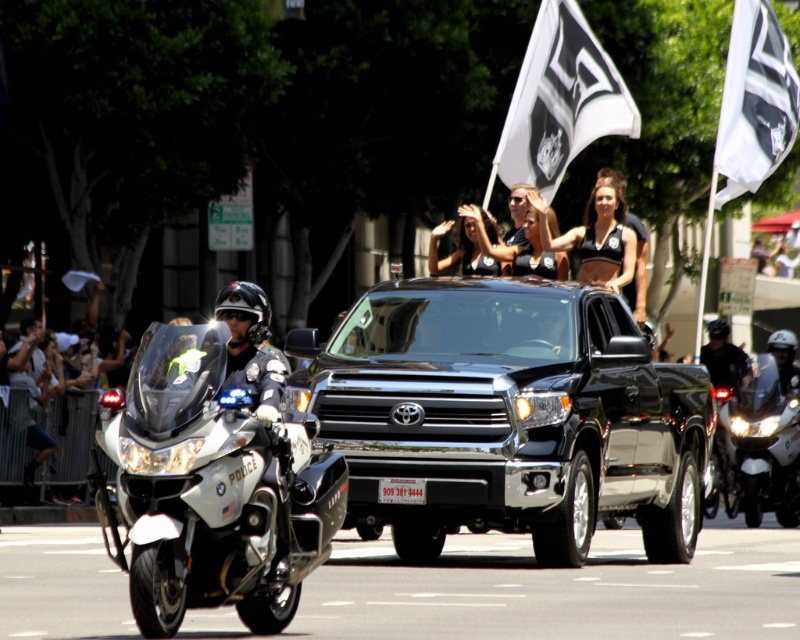
Which is in front, point (512, 132) or point (742, 422)?

Point (742, 422) is more forward.

Does point (594, 131) come behind point (742, 500)?

Yes, point (594, 131) is behind point (742, 500).

Between point (616, 77) and point (772, 362), which one is positioned behind?

The point (616, 77) is behind.

The image size is (800, 640). I want to click on black fabric flag at upper center, so click(560, 100).

Can you confirm if black metallic truck at center is smaller than white fabric flag at upper right?

No, black metallic truck at center is not smaller than white fabric flag at upper right.

Does black metallic truck at center have a lesser height compared to white fabric flag at upper right?

Yes, black metallic truck at center is shorter than white fabric flag at upper right.

Describe the element at coordinates (508, 416) in the screenshot. I see `black metallic truck at center` at that location.

You are a GUI agent. You are given a task and a screenshot of the screen. Output one action in this format:
    pyautogui.click(x=<x>, y=<y>)
    Task: Click on the black metallic truck at center
    The height and width of the screenshot is (640, 800).
    Given the screenshot: What is the action you would take?
    pyautogui.click(x=508, y=416)

Can you confirm if black fabric bikini top at center is positioned to the right of white plastic license plate at center?

Correct, you'll find black fabric bikini top at center to the right of white plastic license plate at center.

Which of these two, black fabric bikini top at center or white plastic license plate at center, stands taller?

Standing taller between the two is black fabric bikini top at center.

Who is more distant from viewer, (540,230) or (420,502)?

The point (540,230) is behind.

This screenshot has width=800, height=640. In order to click on black fabric bikini top at center in this screenshot , I will do `click(596, 237)`.